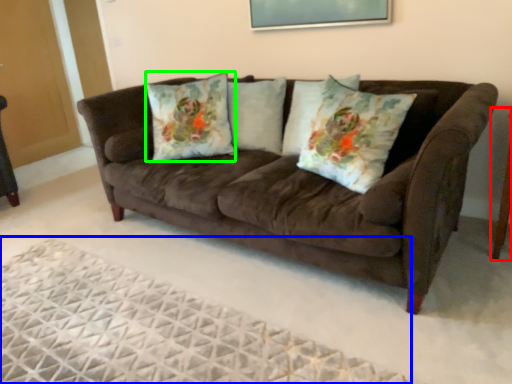
Question: Based on their relative distances, which object is farther from side table (highlighted by a red box)? Choose from plain (highlighted by a blue box) and throw pillow (highlighted by a green box).

Choices:
 (A) plain
 (B) throw pillow

Answer: (B)